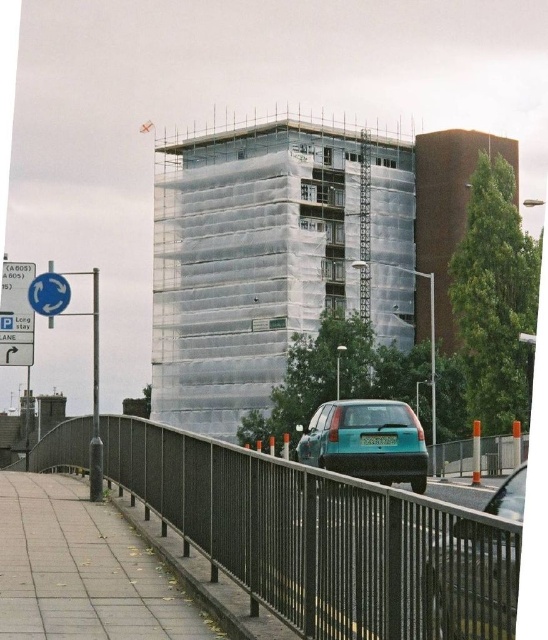
Question: Which of the following is the farthest from the observer?

Choices:
 (A) black metal fence at lower center
 (B) teal matte car at center
 (C) teal matte hatchback at center

Answer: (C)

Question: Does white plastic building at center have a greater width compared to teal matte car at center?

Choices:
 (A) yes
 (B) no

Answer: (A)

Question: Which object is the closest to the black metal fence at lower center?

Choices:
 (A) white plastic building at center
 (B) teal matte car at center
 (C) teal matte hatchback at center
 (D) blue plastic sign at upper left

Answer: (D)

Question: Is teal matte car at center thinner than teal matte hatchback at center?

Choices:
 (A) no
 (B) yes

Answer: (B)

Question: Estimate the real-world distances between objects in this image. Which object is farther from the blue plastic sign at upper left?

Choices:
 (A) teal matte hatchback at center
 (B) black metal fence at lower center
 (C) teal matte car at center

Answer: (C)

Question: Does white plastic building at center appear over teal matte car at center?

Choices:
 (A) yes
 (B) no

Answer: (A)